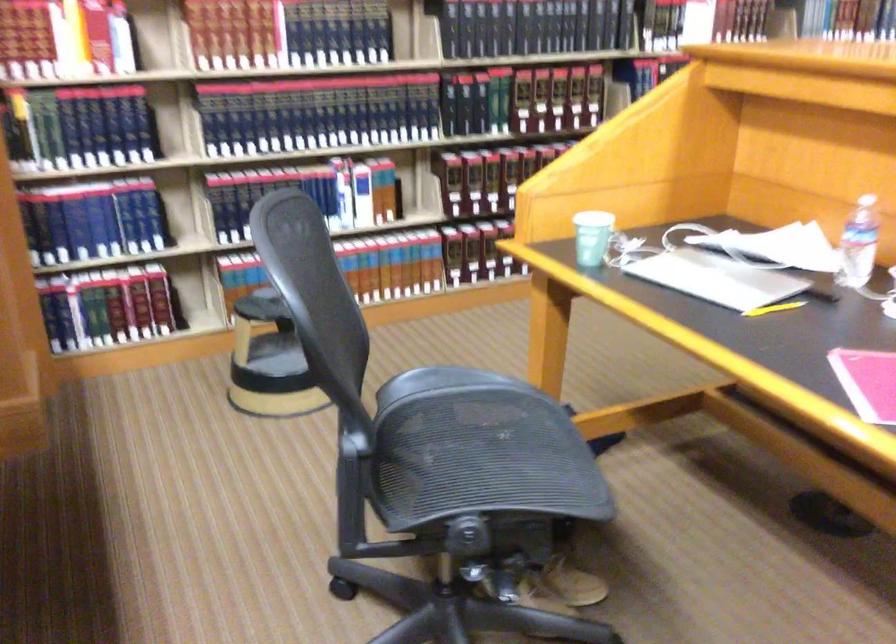
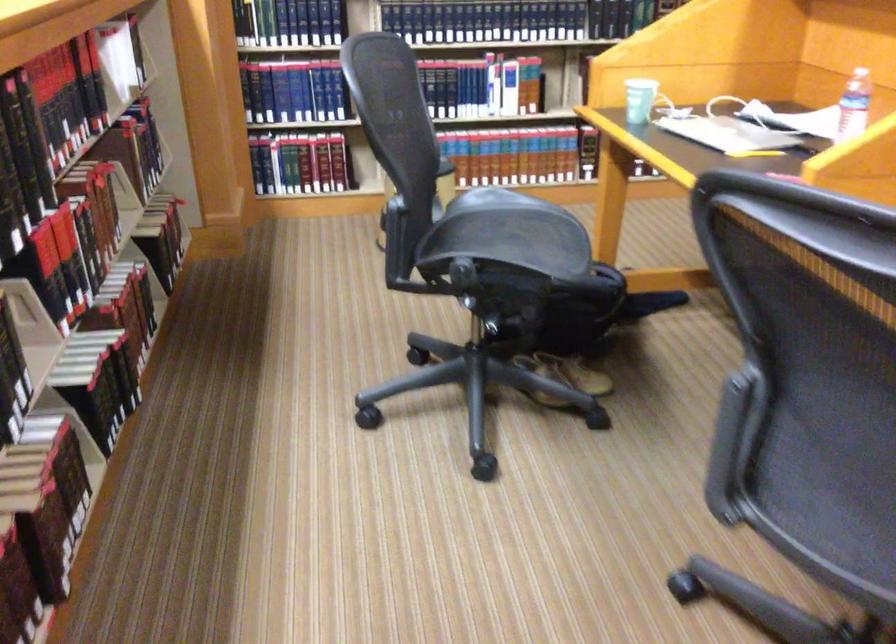
Where in the second image is the point corresponding to point (406, 527) from the first image?

(433, 272)